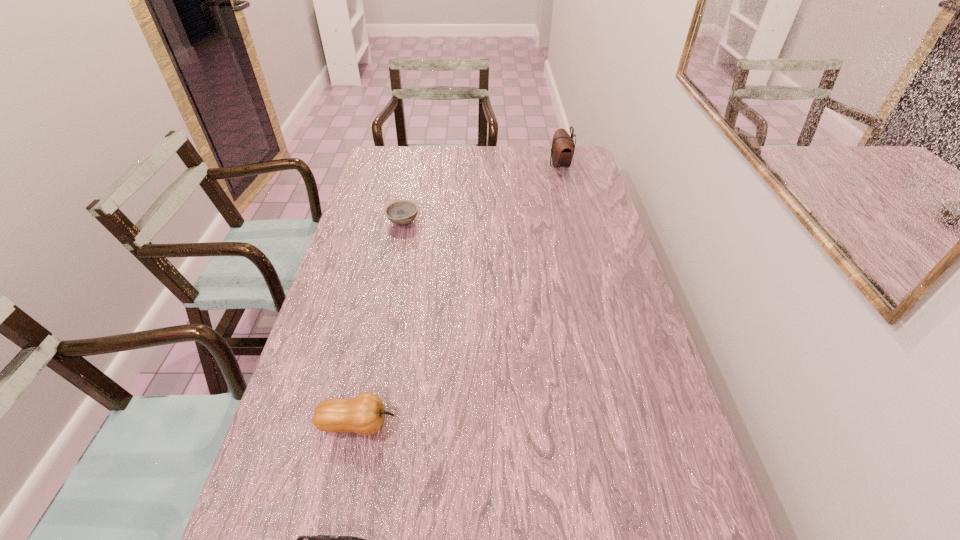
Identify the location of the tallest object. This screenshot has height=540, width=960. (562, 151).

What are the coordinates of `pouch` in the screenshot? It's located at (562, 151).

Locate an element on the screen. The width and height of the screenshot is (960, 540). the second nearest object is located at coordinates (364, 414).

This screenshot has height=540, width=960. Identify the location of gourd. (364, 414).

This screenshot has height=540, width=960. I want to click on bowl, so click(401, 212).

I want to click on vacant region located 0.200m with the flap open on the farthest object, so click(500, 166).

The height and width of the screenshot is (540, 960). Find the location of `vacant region located 0.300m with the flap open on the farthest object`. vacant region located 0.300m with the flap open on the farthest object is located at coordinates (476, 166).

The width and height of the screenshot is (960, 540). I want to click on vacant space located 0.210m with the flap open on the farthest object, so click(498, 166).

You are a GUI agent. You are given a task and a screenshot of the screen. Output one action in this format:
    pyautogui.click(x=<x>, y=<y>)
    Task: Click on the blank area located 0.400m on the stem side of the third shortest object
    The height and width of the screenshot is (540, 960).
    Given the screenshot: What is the action you would take?
    pyautogui.click(x=573, y=424)

Image resolution: width=960 pixels, height=540 pixels. I want to click on vacant space located on the back of the third nearest object, so click(415, 166).